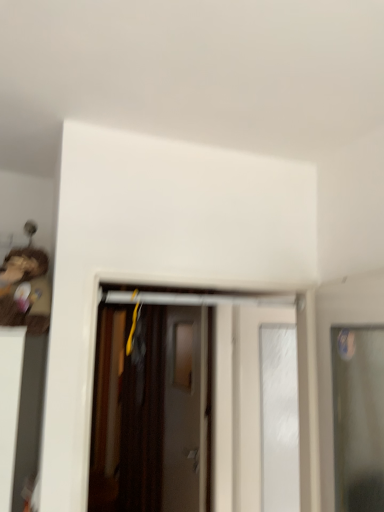
Question: Can you confirm if wooden door at center, the first door in the back-to-front sequence, is taller than wooden toy at left?

Choices:
 (A) no
 (B) yes

Answer: (B)

Question: From a real-world perspective, is wooden door at center, which appears as the 4th door when viewed from the front, below wooden toy at left?

Choices:
 (A) yes
 (B) no

Answer: (A)

Question: Is wooden door at center, which appears as the 4th door when viewed from the front, bigger than wooden toy at left?

Choices:
 (A) yes
 (B) no

Answer: (A)

Question: Is wooden toy at left at the back of wooden door at center, which appears as the 4th door when viewed from the front?

Choices:
 (A) no
 (B) yes

Answer: (A)

Question: Does wooden door at center, the first door in the back-to-front sequence, appear on the right side of wooden toy at left?

Choices:
 (A) yes
 (B) no

Answer: (A)

Question: Is transparent glass door at right, placed as the fourth door when sorted from back to front, in front of or behind white glossy door at center, which is counted as the 3th door, starting from the front, in the image?

Choices:
 (A) front
 (B) behind

Answer: (A)

Question: Is point (367, 476) closer or farther from the camera than point (271, 310)?

Choices:
 (A) closer
 (B) farther

Answer: (A)

Question: In terms of height, does transparent glass door at right, placed as the fourth door when sorted from back to front, look taller or shorter compared to white glossy door at center, the second door positioned from the back?

Choices:
 (A) tall
 (B) short

Answer: (B)

Question: Visually, is transparent glass door at right, placed as the fourth door when sorted from back to front, positioned to the left or to the right of white glossy door at center, the second door positioned from the back?

Choices:
 (A) left
 (B) right

Answer: (B)

Question: Considering the positions of white glossy door at center, the second door positioned from the back, and wooden toy at left in the image, is white glossy door at center, the second door positioned from the back, bigger or smaller than wooden toy at left?

Choices:
 (A) small
 (B) big

Answer: (B)

Question: From the image's perspective, relative to wooden toy at left, is white glossy door at center, which is counted as the 3th door, starting from the front, above or below?

Choices:
 (A) below
 (B) above

Answer: (A)

Question: Is white glossy door at center, the second door positioned from the back, wider or thinner than wooden toy at left?

Choices:
 (A) thin
 (B) wide

Answer: (A)

Question: Choose the correct answer: Is white glossy door at center, the second door positioned from the back, inside wooden toy at left or outside it?

Choices:
 (A) inside
 (B) outside

Answer: (B)

Question: Considering the positions of wooden toy at left and white glossy door at center, which is counted as the 3th door, starting from the front, in the image, is wooden toy at left taller or shorter than white glossy door at center, which is counted as the 3th door, starting from the front,?

Choices:
 (A) short
 (B) tall

Answer: (A)

Question: Considering the positions of point (38, 318) and point (253, 378), is point (38, 318) closer or farther from the camera than point (253, 378)?

Choices:
 (A) closer
 (B) farther

Answer: (A)